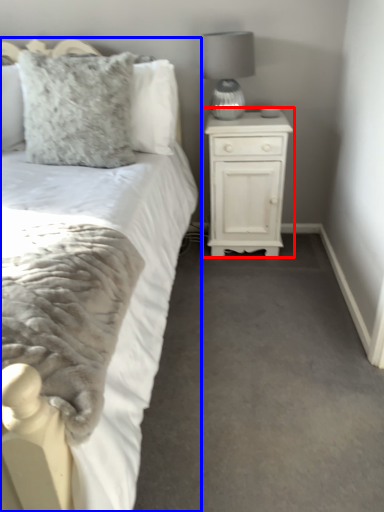
Question: Which object appears closest to the camera in this image, nightstand (highlighted by a red box) or bed (highlighted by a blue box)?

Choices:
 (A) nightstand
 (B) bed

Answer: (B)